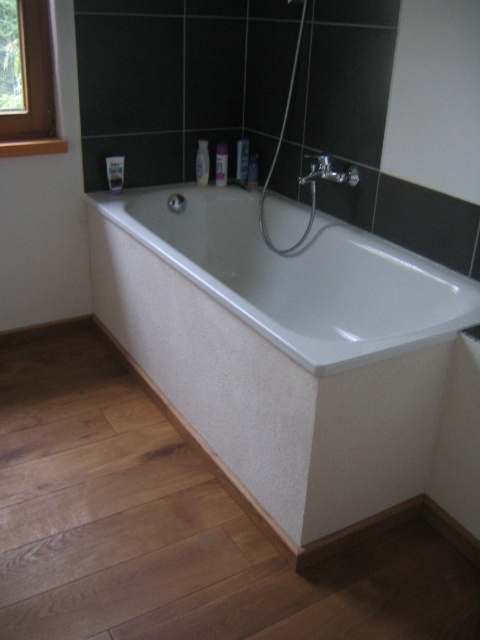
Question: Does wooden frame at upper left appear under matte silver faucet at upper center?

Choices:
 (A) no
 (B) yes

Answer: (A)

Question: Among these objects, which one is nearest to the camera?

Choices:
 (A) white textured bath at center
 (B) wooden frame at upper left

Answer: (A)

Question: Is white textured bath at center in front of wooden frame at upper left?

Choices:
 (A) no
 (B) yes

Answer: (B)

Question: Does white textured bath at center have a larger size compared to wooden frame at upper left?

Choices:
 (A) yes
 (B) no

Answer: (A)

Question: Which of the following is the closest to the observer?

Choices:
 (A) (43, 54)
 (B) (339, 179)
 (C) (400, 385)

Answer: (C)

Question: Which point is farther to the camera?

Choices:
 (A) matte silver faucet at upper center
 (B) wooden frame at upper left

Answer: (B)